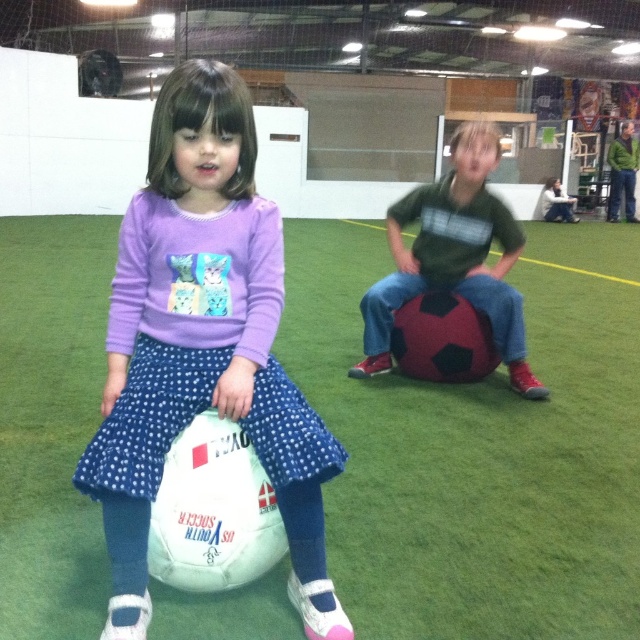
You are a photographer standing at the back of the indoor sports facility. You want to take a photo of the green artificial turf at center and the dark green jersey at center. Which object will appear larger in your photo?

The green artificial turf at center will appear larger in the photo because it is closer to the viewer than the dark green jersey at center.

You are a coach preparing to set up a soccer drill. You need to place two cones exactly 1.5 meters apart. The green artificial turf at center and the white matte soccer ball at center are in the way. Can you fit the cones between them?

The distance between the green artificial turf at center and the white matte soccer ball at center is 1.22 meters. Since the cones need to be 1.5 meters apart, there isn

You are a coach observing the indoor sports facility. You notice the green artificial turf at center and the white matte soccer ball at center. Which object is positioned lower in the scene?

The green artificial turf at center is positioned below the white matte soccer ball at center, so the green artificial turf at center is lower.